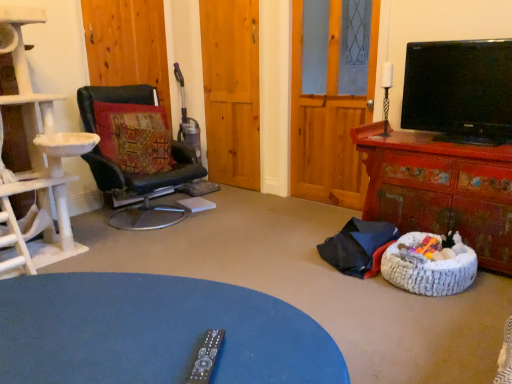
Question: Is wooden door at center, the first door viewed from the left, shorter than black leather chair at left?

Choices:
 (A) yes
 (B) no

Answer: (B)

Question: Considering the relative sizes of wooden door at center, the first door viewed from the left, and black leather chair at left in the image provided, is wooden door at center, the first door viewed from the left, taller than black leather chair at left?

Choices:
 (A) no
 (B) yes

Answer: (B)

Question: From a real-world perspective, is wooden door at center, the first door viewed from the left, physically below black leather chair at left?

Choices:
 (A) no
 (B) yes

Answer: (A)

Question: Is wooden door at center, the first door viewed from the left, looking in the opposite direction of black leather chair at left?

Choices:
 (A) yes
 (B) no

Answer: (B)

Question: Does wooden door at center, the first door viewed from the left, appear on the right side of black leather chair at left?

Choices:
 (A) yes
 (B) no

Answer: (B)

Question: From a real-world perspective, relative to black leather chair at left, is wooden door at center, the 2th door when ordered from left to right, vertically above or below?

Choices:
 (A) below
 (B) above

Answer: (B)

Question: Is wooden door at center, the first door positioned from the right, situated inside black leather chair at left or outside?

Choices:
 (A) outside
 (B) inside

Answer: (A)

Question: In terms of width, does wooden door at center, the 2th door when ordered from left to right, look wider or thinner when compared to black leather chair at left?

Choices:
 (A) thin
 (B) wide

Answer: (A)

Question: Does point (223, 74) appear closer or farther from the camera than point (128, 105)?

Choices:
 (A) farther
 (B) closer

Answer: (A)

Question: Visually, is wooden glass door at center positioned to the left or to the right of white woven dog bed at lower right?

Choices:
 (A) left
 (B) right

Answer: (A)

Question: From the image's perspective, is wooden glass door at center located above or below white woven dog bed at lower right?

Choices:
 (A) below
 (B) above

Answer: (B)

Question: Relative to white woven dog bed at lower right, is wooden glass door at center in front or behind?

Choices:
 (A) behind
 (B) front

Answer: (A)

Question: Is wooden glass door at center taller or shorter than white woven dog bed at lower right?

Choices:
 (A) short
 (B) tall

Answer: (B)

Question: Is white woven dog bed at lower right to the left or to the right of distressed red wooden cabinet at right in the image?

Choices:
 (A) left
 (B) right

Answer: (A)

Question: Looking at their shapes, would you say white woven dog bed at lower right is wider or thinner than distressed red wooden cabinet at right?

Choices:
 (A) thin
 (B) wide

Answer: (A)